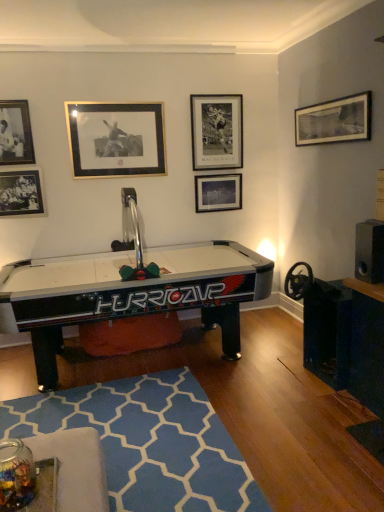
Question: Is blue fabric rug at lower center at the right side of metallic silver picture frame at upper center, which ranks as the fourth picture frame in left-to-right order?

Choices:
 (A) yes
 (B) no

Answer: (B)

Question: Is the position of blue fabric rug at lower center more distant than that of metallic silver picture frame at upper center, which ranks as the fourth picture frame in left-to-right order?

Choices:
 (A) no
 (B) yes

Answer: (A)

Question: From a real-world perspective, is blue fabric rug at lower center located beneath metallic silver picture frame at upper center, acting as the third picture frame starting from the right?

Choices:
 (A) yes
 (B) no

Answer: (A)

Question: Can you confirm if blue fabric rug at lower center is thinner than metallic silver picture frame at upper center, which ranks as the fourth picture frame in left-to-right order?

Choices:
 (A) no
 (B) yes

Answer: (A)

Question: Considering the relative sizes of blue fabric rug at lower center and metallic silver picture frame at upper center, which ranks as the fourth picture frame in left-to-right order, in the image provided, is blue fabric rug at lower center wider than metallic silver picture frame at upper center, which ranks as the fourth picture frame in left-to-right order,?

Choices:
 (A) no
 (B) yes

Answer: (B)

Question: Considering the relative positions of blue fabric rug at lower center and metallic silver picture frame at upper center, which ranks as the fourth picture frame in left-to-right order, in the image provided, is blue fabric rug at lower center in front of metallic silver picture frame at upper center, which ranks as the fourth picture frame in left-to-right order,?

Choices:
 (A) yes
 (B) no

Answer: (A)

Question: Does matte black picture frame at upper left, the 6th picture frame from the right, turn towards metallic silver picture frame at upper center, acting as the third picture frame starting from the right?

Choices:
 (A) yes
 (B) no

Answer: (B)

Question: Does matte black picture frame at upper left, the 6th picture frame from the right, have a greater height compared to metallic silver picture frame at upper center, which ranks as the fourth picture frame in left-to-right order?

Choices:
 (A) yes
 (B) no

Answer: (B)

Question: Would you say matte black picture frame at upper left, which is counted as the first picture frame, starting from the left, contains metallic silver picture frame at upper center, which ranks as the fourth picture frame in left-to-right order?

Choices:
 (A) yes
 (B) no

Answer: (B)

Question: Is matte black picture frame at upper left, the 6th picture frame from the right, closer to camera compared to metallic silver picture frame at upper center, acting as the third picture frame starting from the right?

Choices:
 (A) yes
 (B) no

Answer: (A)

Question: Does matte black picture frame at upper left, the 6th picture frame from the right, appear on the left side of metallic silver picture frame at upper center, acting as the third picture frame starting from the right?

Choices:
 (A) yes
 (B) no

Answer: (A)

Question: Is matte black picture frame at upper left, the 6th picture frame from the right, wider than metallic silver picture frame at upper center, which ranks as the fourth picture frame in left-to-right order?

Choices:
 (A) yes
 (B) no

Answer: (B)

Question: From the image's perspective, is matte black picture frame at upper left, which is counted as the first picture frame, starting from the left, located beneath black plastic speaker at right?

Choices:
 (A) no
 (B) yes

Answer: (A)